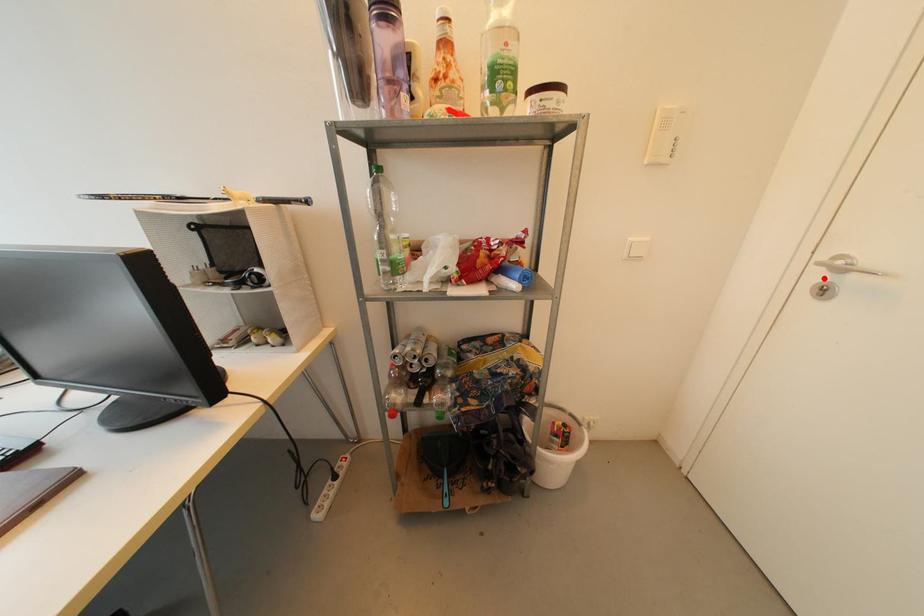
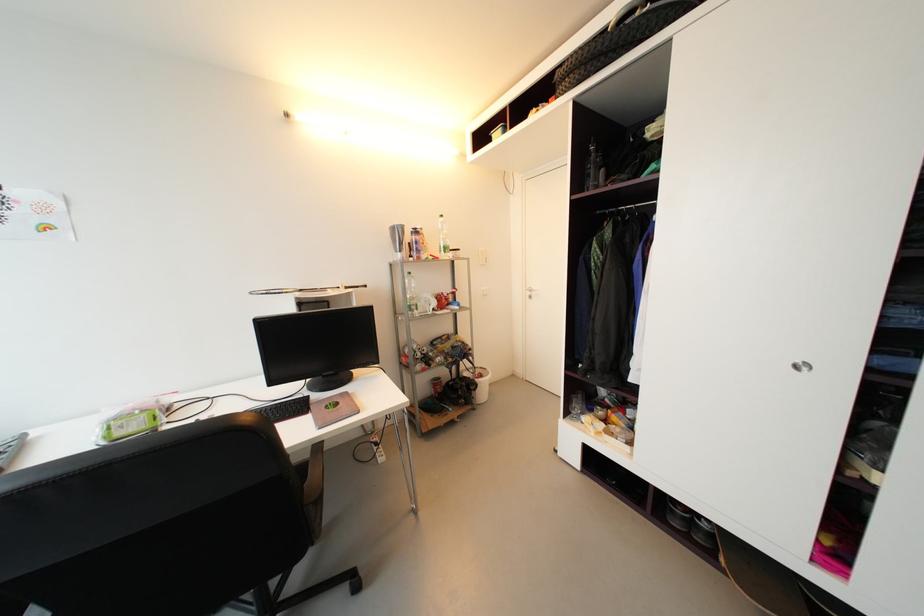
Locate, in the second image, the point that corresponds to the highlighted location in the first image.

(533, 294)